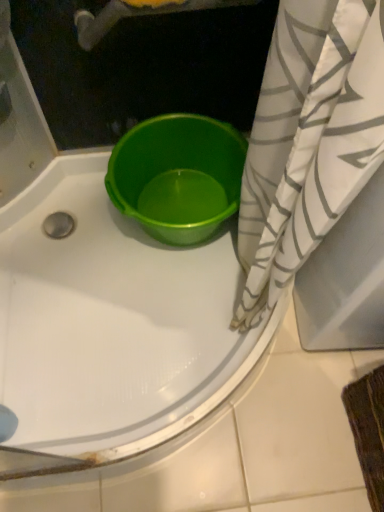
Question: From a real-world perspective, is matte green tub at center positioned over green plastic bucket at center based on gravity?

Choices:
 (A) yes
 (B) no

Answer: (A)

Question: Can green plastic bucket at center be found inside matte green tub at center?

Choices:
 (A) no
 (B) yes

Answer: (B)

Question: Is matte green tub at center placed right next to green plastic bucket at center?

Choices:
 (A) yes
 (B) no

Answer: (B)

Question: From the image's perspective, is matte green tub at center above green plastic bucket at center?

Choices:
 (A) no
 (B) yes

Answer: (A)

Question: Considering the relative sizes of matte green tub at center and green plastic bucket at center in the image provided, is matte green tub at center thinner than green plastic bucket at center?

Choices:
 (A) no
 (B) yes

Answer: (A)

Question: Considering their positions, is white/gray striped fabric at right located in front of or behind green plastic bucket at center?

Choices:
 (A) behind
 (B) front

Answer: (B)

Question: From a real-world perspective, is white/gray striped fabric at right above or below green plastic bucket at center?

Choices:
 (A) below
 (B) above

Answer: (B)

Question: Visually, is white/gray striped fabric at right positioned to the left or to the right of green plastic bucket at center?

Choices:
 (A) right
 (B) left

Answer: (A)

Question: Considering the positions of point (324, 182) and point (137, 130), is point (324, 182) closer or farther from the camera than point (137, 130)?

Choices:
 (A) farther
 (B) closer

Answer: (B)

Question: Considering the positions of point coord(238,153) and point coord(294,121), is point coord(238,153) closer or farther from the camera than point coord(294,121)?

Choices:
 (A) farther
 (B) closer

Answer: (A)

Question: From the image's perspective, is green plastic bucket at center located above or below white/gray striped fabric at right?

Choices:
 (A) below
 (B) above

Answer: (B)

Question: Looking at the image, does green plastic bucket at center seem bigger or smaller compared to white/gray striped fabric at right?

Choices:
 (A) big
 (B) small

Answer: (B)

Question: From a real-world perspective, is green plastic bucket at center physically located above or below white/gray striped fabric at right?

Choices:
 (A) above
 (B) below

Answer: (B)

Question: From a real-world perspective, is white/gray striped fabric at right above or below matte green tub at center?

Choices:
 (A) below
 (B) above

Answer: (A)

Question: Choose the correct answer: Is white/gray striped fabric at right inside matte green tub at center or outside it?

Choices:
 (A) inside
 (B) outside

Answer: (B)